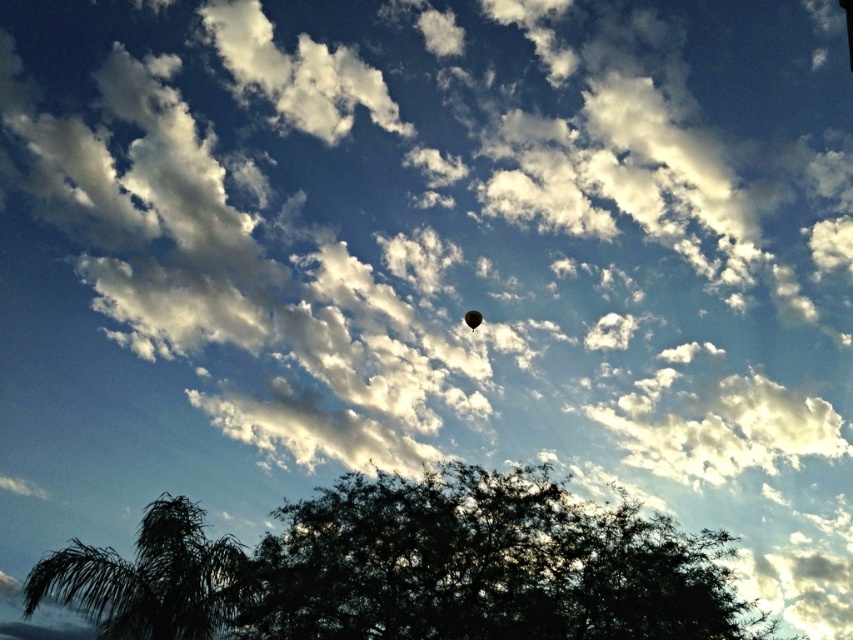
You are standing in a field looking at the dark green leafy tree at center and the green leafy tree at lower left. Which tree would appear larger in your view?

The dark green leafy tree at center appears larger because it is closer to the viewer than the green leafy tree at lower left.

You are standing in the scene and want to locate the point at coordinates point (149, 579). Based on the scene description, where would you find this point?

Answer: The point (149, 579) is located on the green leafy tree at lower left.